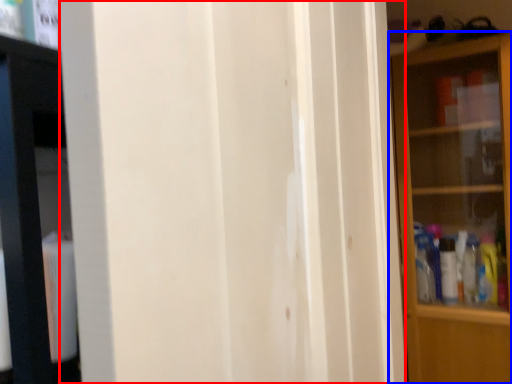
Question: Which object is further to the camera taking this photo, screen door (highlighted by a red box) or shelf (highlighted by a blue box)?

Choices:
 (A) screen door
 (B) shelf

Answer: (B)